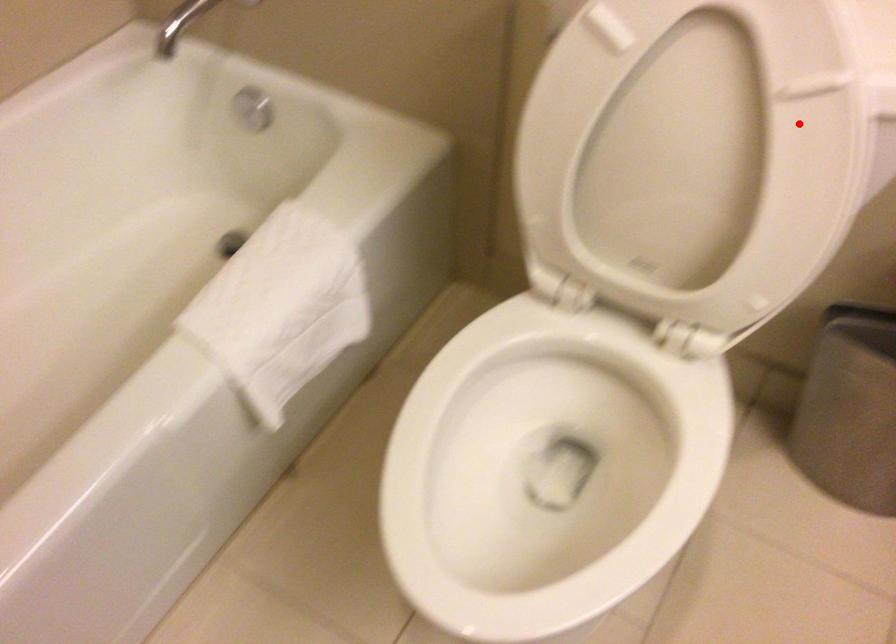
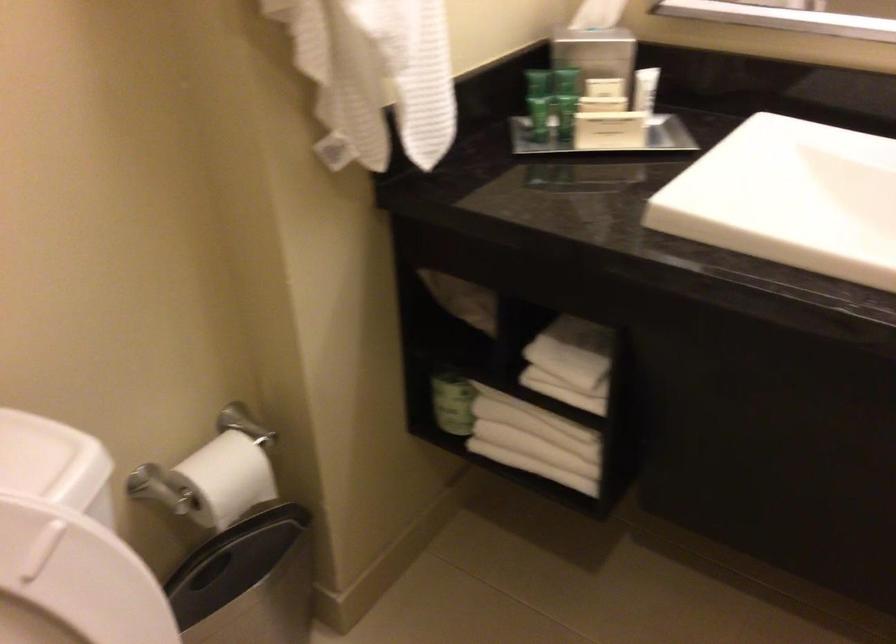
The point at the highlighted location is marked in the first image. Where is the corresponding point in the second image?

(73, 582)